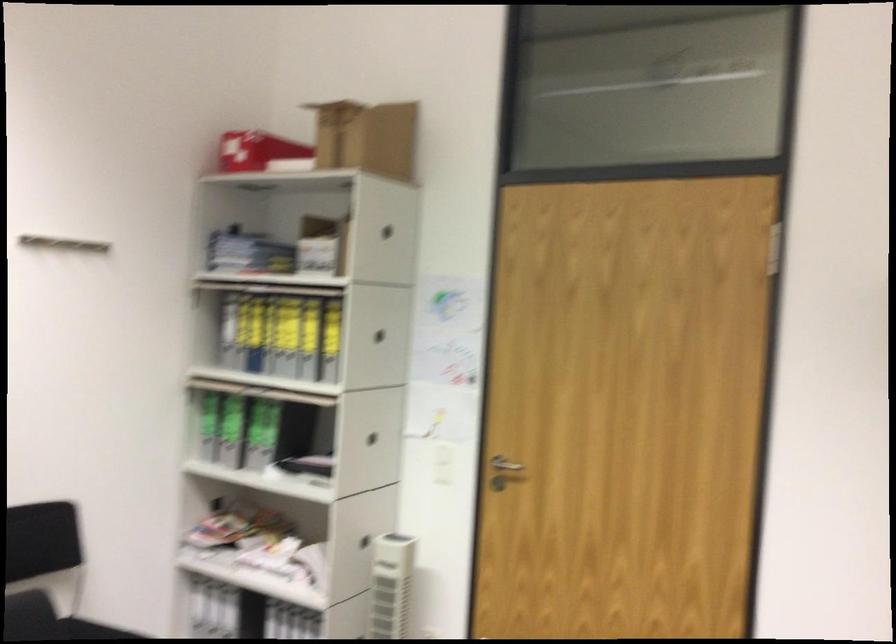
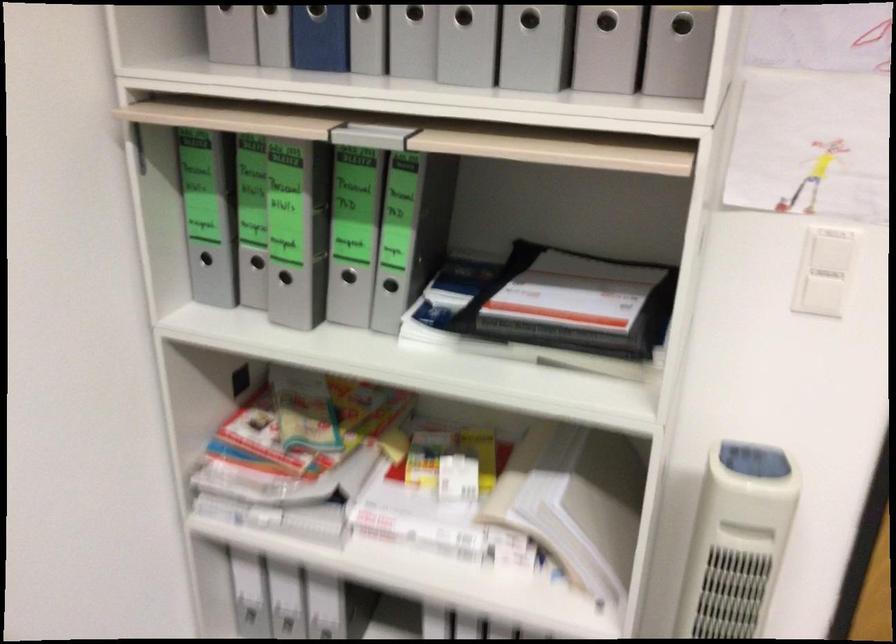
The point at (276, 453) is marked in the first image. Where is the corresponding point in the second image?

(390, 285)